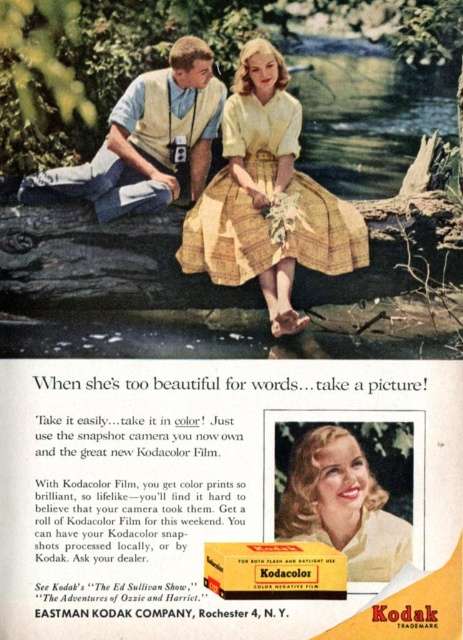
In the vintage Kodak advertisement, there is a picturesque outdoor scene with two people by a riverbank. The man is wearing a light vest and holding a camera, while the woman is in a yellow dress. A point labeled with coordinates is present in the image. What object is located at the coordinates point [267,196]?

The point [267,196] marks the yellow woven dress at center.

You are looking at the vintage Kodak advertisement image. There are two points marked in the image. The first point is at coordinates point (229, 573) and the second point is at point (268, 67). Which of these two points is closer to the camera?

Point (229, 573) is closer to the camera than point (268, 67).